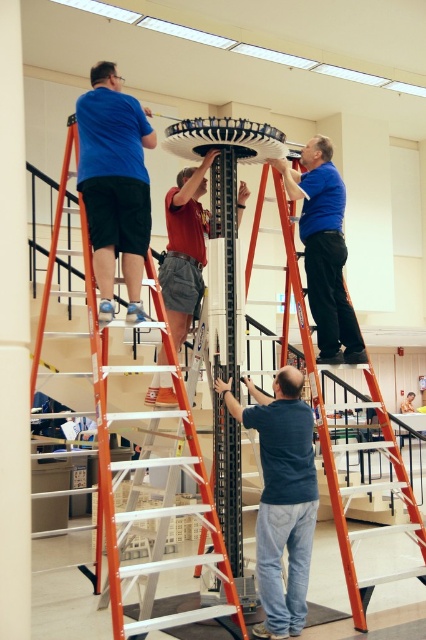
Question: Considering the relative positions of orange plastic ladder at center and dark blue shirt at center in the image provided, where is orange plastic ladder at center located with respect to dark blue shirt at center?

Choices:
 (A) below
 (B) above

Answer: (A)

Question: Can you confirm if orange plastic ladder at center is positioned to the left of matte blue shirt at upper center?

Choices:
 (A) yes
 (B) no

Answer: (A)

Question: Considering the relative positions of orange plastic ladder at center and dark blue shirt at center in the image provided, where is orange plastic ladder at center located with respect to dark blue shirt at center?

Choices:
 (A) above
 (B) below

Answer: (B)

Question: Which point appears closest to the camera in this image?

Choices:
 (A) (270, 540)
 (B) (36, 374)
 (C) (287, 237)
 (D) (112, 65)

Answer: (A)

Question: Estimate the real-world distances between objects in this image. Which object is farther from the matte blue shirt at upper center?

Choices:
 (A) reddish-brown fabric shirt at center
 (B) dark blue shirt at center
 (C) matte blue shirt at upper left

Answer: (C)

Question: Which point is closer to the camera?

Choices:
 (A) (311, 164)
 (B) (291, 230)
 (C) (244, 196)

Answer: (B)